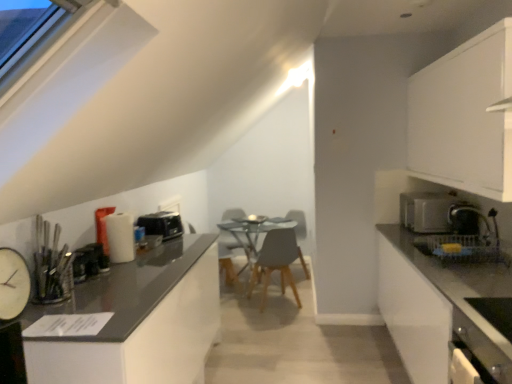
What do you see at coordinates (162, 224) in the screenshot? This screenshot has width=512, height=384. I see `black plastic toaster at left, the 2th appliance when ordered from right to left` at bounding box center [162, 224].

Describe the element at coordinates (277, 262) in the screenshot. The width and height of the screenshot is (512, 384). I see `light gray matte chair at center` at that location.

Image resolution: width=512 pixels, height=384 pixels. What do you see at coordinates (464, 116) in the screenshot?
I see `white matte cabinet at upper right, arranged as the first cabinetry when viewed from the top` at bounding box center [464, 116].

Where is `white glossy countertop at right`? This screenshot has width=512, height=384. white glossy countertop at right is located at coordinates (457, 278).

Is white glossy countertop at right not within black plastic toaster at left, the third appliance in the left-to-right sequence?

Yes, white glossy countertop at right is located beyond the bounds of black plastic toaster at left, the third appliance in the left-to-right sequence.

Can you confirm if white glossy countertop at right is smaller than black plastic toaster at left, the 2th appliance when ordered from right to left?

No, white glossy countertop at right is not smaller than black plastic toaster at left, the 2th appliance when ordered from right to left.

From a real-world perspective, which is physically below, white glossy countertop at right or black plastic toaster at left, the 2th appliance when ordered from right to left?

white glossy countertop at right.

Could light gray matte chair at center be considered to be inside metallic black toaster at left, acting as the 2th appliance starting from the front?

Actually, light gray matte chair at center is outside metallic black toaster at left, acting as the 2th appliance starting from the front.

Which of these two, metallic black toaster at left, positioned as the second appliance in left-to-right order, or light gray matte chair at center, is thinner?

metallic black toaster at left, positioned as the second appliance in left-to-right order.

From a real-world perspective, is metallic black toaster at left, which is the third appliance from back to front, located higher than light gray matte chair at center?

Yes, from a real-world perspective, metallic black toaster at left, which is the third appliance from back to front, is over light gray matte chair at center

Considering the relative positions of metallic black toaster at left, acting as the 2th appliance starting from the front, and light gray matte chair at center in the image provided, is metallic black toaster at left, acting as the 2th appliance starting from the front, behind light gray matte chair at center?

No, metallic black toaster at left, acting as the 2th appliance starting from the front, is closer to the viewer.

From the image's perspective, is matte gray swivel chair at center located above white matte cabinet at upper right, arranged as the first cabinetry when viewed from the top?

Actually, matte gray swivel chair at center appears below white matte cabinet at upper right, arranged as the first cabinetry when viewed from the top, in the image.

Is matte gray swivel chair at center not inside white matte cabinet at upper right, arranged as the first cabinetry when viewed from the top?

Yes, matte gray swivel chair at center is located beyond the bounds of white matte cabinet at upper right, arranged as the first cabinetry when viewed from the top.

Based on the photo, between matte gray swivel chair at center and white matte cabinet at upper right, the 2th cabinetry in the bottom-to-top sequence, which one is positioned behind?

matte gray swivel chair at center is behind.

Are matte gray swivel chair at center and white matte cabinet at upper right, which is counted as the 1th cabinetry, starting from the right, far apart?

Indeed, matte gray swivel chair at center is not near white matte cabinet at upper right, which is counted as the 1th cabinetry, starting from the right.

Can you confirm if metallic black toaster at left, acting as the 2th appliance starting from the front, is smaller than matte gray swivel chair at center?

Yes, metallic black toaster at left, acting as the 2th appliance starting from the front, is smaller than matte gray swivel chair at center.

This screenshot has height=384, width=512. I want to click on the 1st appliance positioned above the matte gray swivel chair at center (from the image's perspective), so click(89, 262).

From the image's perspective, is metallic black toaster at left, which is the 3th appliance from right to left, above matte gray swivel chair at center?

Yes, from the image's perspective, metallic black toaster at left, which is the 3th appliance from right to left, is on top of matte gray swivel chair at center.

Between metallic black toaster at left, positioned as the second appliance in left-to-right order, and matte gray swivel chair at center, which one is positioned behind?

matte gray swivel chair at center.

From a real-world perspective, is white matte cabinet at upper right, the 2th cabinetry in the bottom-to-top sequence, physically above satin silver toaster at right?

Yes, from a real-world perspective, white matte cabinet at upper right, the 2th cabinetry in the bottom-to-top sequence, is over satin silver toaster at right

Can we say white matte cabinet at upper right, the 2th cabinetry in the bottom-to-top sequence, lies outside satin silver toaster at right?

Absolutely, white matte cabinet at upper right, the 2th cabinetry in the bottom-to-top sequence, is external to satin silver toaster at right.

Does point (409, 158) lie behind point (410, 215)?

Yes, point (409, 158) is farther from viewer.

Where is `kitchen appliance located below the white matte cabinet at upper right, arranged as the first cabinetry when viewed from the top (from the image's perspective)`? This screenshot has width=512, height=384. kitchen appliance located below the white matte cabinet at upper right, arranged as the first cabinetry when viewed from the top (from the image's perspective) is located at coordinates (426, 211).

In the scene shown: Does light gray matte chair at center turn towards satin silver toaster at right?

No, light gray matte chair at center is not aimed at satin silver toaster at right.

How different are the orientations of light gray matte chair at center and satin silver toaster at right in degrees?

The angular difference between light gray matte chair at center and satin silver toaster at right is 73.5 degrees.

Is light gray matte chair at center directly adjacent to satin silver toaster at right?

light gray matte chair at center and satin silver toaster at right are clearly separated.

Which is correct: light gray matte chair at center is inside satin silver toaster at right, or outside of it?

light gray matte chair at center exists outside the volume of satin silver toaster at right.

Consider the image. Is white clock at left, the 1th appliance from the left, thinner than black plastic toaster at left, the third appliance in the left-to-right sequence?

Yes.

Can black plastic toaster at left, the 2th appliance when ordered from right to left, be found inside white clock at left, the 1th appliance from the left?

No.

Is the position of white clock at left, marked as the first appliance in a front-to-back arrangement, more distant than that of black plastic toaster at left, the 2th appliance when ordered from right to left?

No.

From the image's perspective, which object appears higher, white clock at left, which ranks as the 4th appliance in right-to-left order, or black plastic toaster at left, which ranks as the 1th appliance in back-to-front order?

From the image's view, black plastic toaster at left, which ranks as the 1th appliance in back-to-front order, is above.

Where is `countertop on the right side of black plastic toaster at left, the 2th appliance when ordered from right to left`? The height and width of the screenshot is (384, 512). countertop on the right side of black plastic toaster at left, the 2th appliance when ordered from right to left is located at coordinates (457, 278).

Where is `the 2nd appliance counting from the left side of the light gray matte chair at center`? This screenshot has height=384, width=512. the 2nd appliance counting from the left side of the light gray matte chair at center is located at coordinates (89, 262).

From the picture: Estimate the real-world distances between objects in this image. Which object is closer to black plastic toaster at left, which ranks as the 1th appliance in back-to-front order, metallic black toaster at left, which is the 3th appliance from right to left, or white clock at left, the 4th appliance in the back-to-front sequence?

metallic black toaster at left, which is the 3th appliance from right to left, is positioned closer to the anchor black plastic toaster at left, which ranks as the 1th appliance in back-to-front order.

When comparing their distances from white clock at left, the 1th appliance from the left, does white glossy countertop at left, which is the 2th cabinetry in right-to-left order, or light gray matte chair at center seem closer?

Among the two, white glossy countertop at left, which is the 2th cabinetry in right-to-left order, is located nearer to white clock at left, the 1th appliance from the left.

Which object lies nearer to the anchor point metallic black toaster at left, which is the 3th appliance from right to left, matte gray swivel chair at center or white matte cabinet at upper right, which is counted as the 1th cabinetry, starting from the right?

white matte cabinet at upper right, which is counted as the 1th cabinetry, starting from the right.

When comparing their distances from light gray matte chair at center, does matte gray swivel chair at center or satin silver toaster at right seem further?

The object further to light gray matte chair at center is satin silver toaster at right.

From the picture: Looking at the image, which one is located closer to white glossy dishwasher at lower right, black plastic toaster at left, the 2th appliance when ordered from right to left, or metallic black toaster at left, positioned as the second appliance in left-to-right order?

metallic black toaster at left, positioned as the second appliance in left-to-right order, is positioned closer to the anchor white glossy dishwasher at lower right.

Based on their spatial positions, is black plastic toaster at left, the 2th appliance when ordered from right to left, or metallic black toaster at left, which is the 3th appliance from right to left, further from light gray matte chair at center?

Among the two, metallic black toaster at left, which is the 3th appliance from right to left, is located further to light gray matte chair at center.

Based on their spatial positions, is white glossy countertop at right or light gray matte chair at center further from white glossy dishwasher at lower right?

Among the two, light gray matte chair at center is located further to white glossy dishwasher at lower right.

From the image, which object appears to be nearer to white clock at left, marked as the first appliance in a front-to-back arrangement, white matte cabinet at upper right, which is counted as the 1th cabinetry, starting from the right, or white glossy dishwasher at lower right?

white glossy dishwasher at lower right is closer to white clock at left, marked as the first appliance in a front-to-back arrangement.

Find the location of a particular element. The height and width of the screenshot is (384, 512). kitchen appliance located between white glossy dishwasher at lower right and light gray matte chair at center in the depth direction is located at coordinates (426, 211).

Where is `table located between white glossy countertop at left, positioned as the second cabinetry in top-to-bottom order, and matte gray swivel chair at center in the depth direction`? The image size is (512, 384). table located between white glossy countertop at left, positioned as the second cabinetry in top-to-bottom order, and matte gray swivel chair at center in the depth direction is located at coordinates (252, 234).

This screenshot has height=384, width=512. I want to click on cabinetry between white clock at left, marked as the first appliance in a front-to-back arrangement, and white matte cabinet at upper right, the 2th cabinetry in the bottom-to-top sequence, in the horizontal direction, so click(x=137, y=320).

Where is `countertop situated between metallic black toaster at left, positioned as the second appliance in left-to-right order, and white matte cabinet at upper right, which is counted as the 1th cabinetry, starting from the right, from left to right`? The width and height of the screenshot is (512, 384). countertop situated between metallic black toaster at left, positioned as the second appliance in left-to-right order, and white matte cabinet at upper right, which is counted as the 1th cabinetry, starting from the right, from left to right is located at coordinates 457,278.